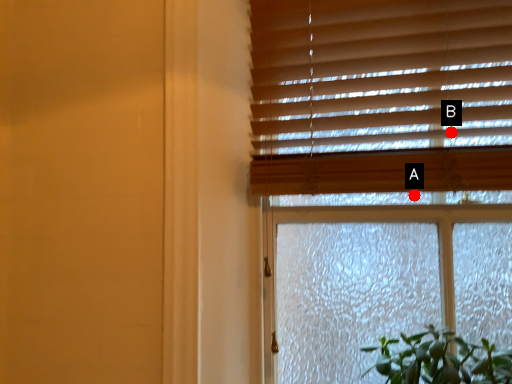
Question: Two points are circled on the image, labeled by A and B beside each circle. Which of the following is the closest to the observer?

Choices:
 (A) A is closer
 (B) B is closer

Answer: (B)